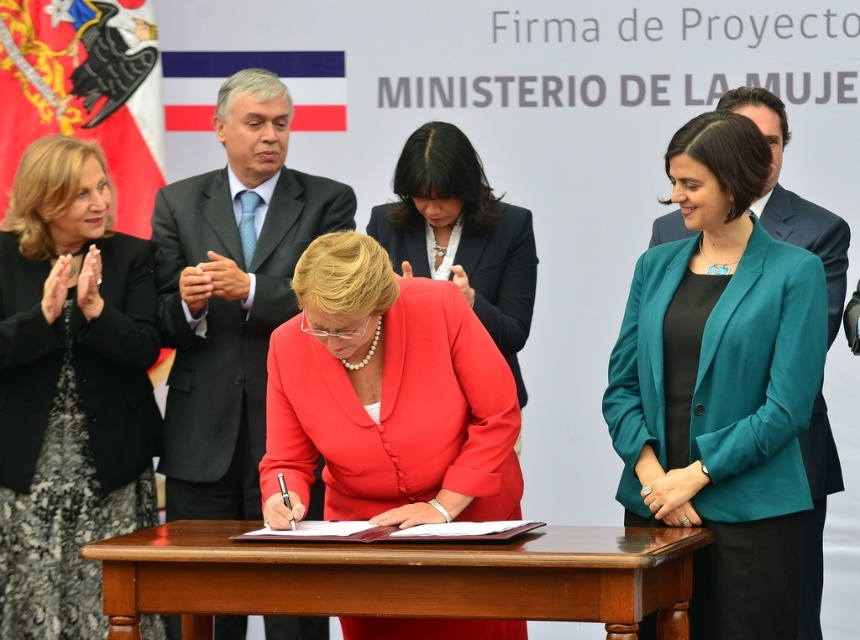
What are the coordinates of the black lace dress at upper left?

The black lace dress at upper left is located at point [69,388].

You are attending a formal event and notice the black lace dress at upper left and the brown wooden table at center. Which object is taller?

The black lace dress at upper left is taller than the brown wooden table at center.